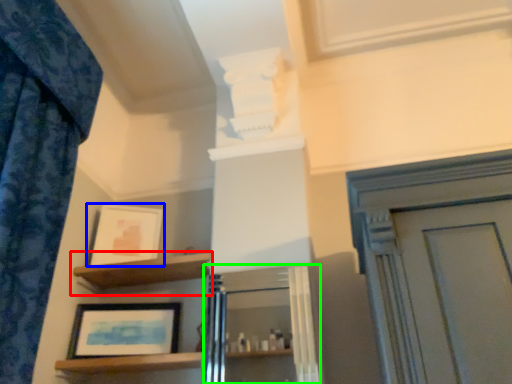
Question: Which object is the farthest from shelf (highlighted by a red box)? Choose among these: picture frame (highlighted by a blue box) or cabinetry (highlighted by a green box).

Choices:
 (A) picture frame
 (B) cabinetry

Answer: (B)